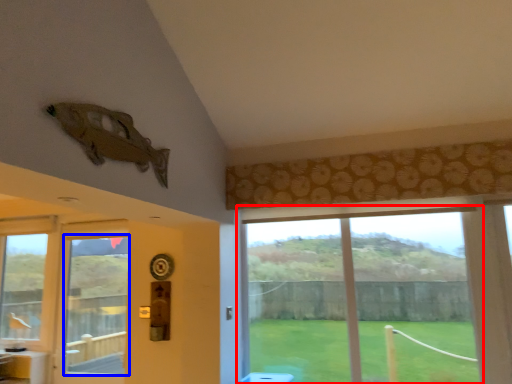
Question: Which point is further to the camera, window (highlighted by a red box) or window screen (highlighted by a blue box)?

Choices:
 (A) window
 (B) window screen

Answer: (B)